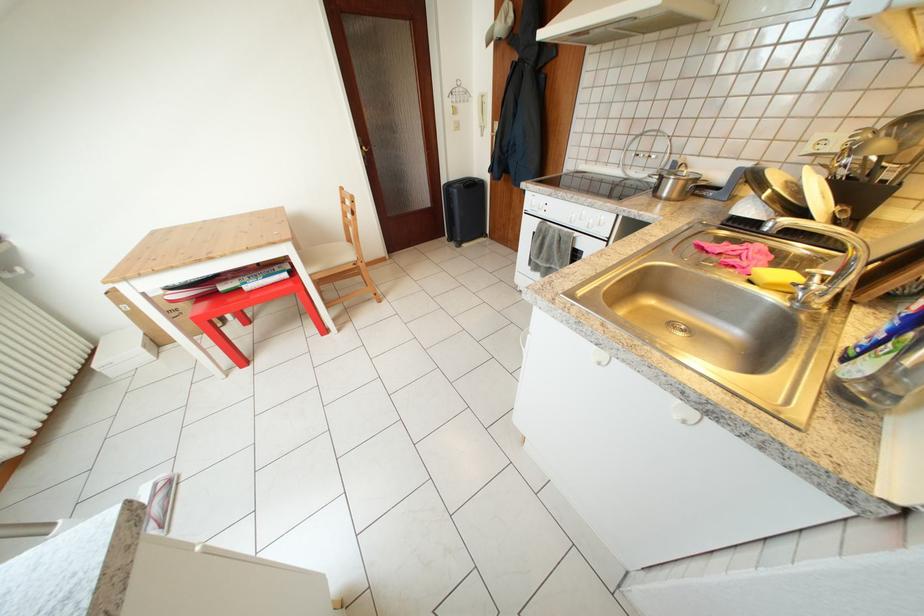
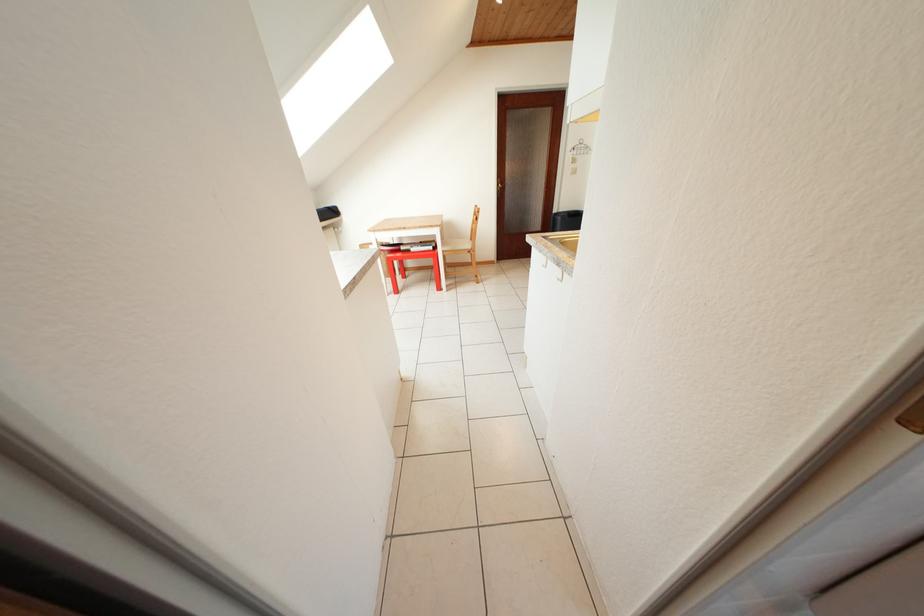
Find the pixel in the second image that matches (x=455, y=97) in the first image.

(578, 153)